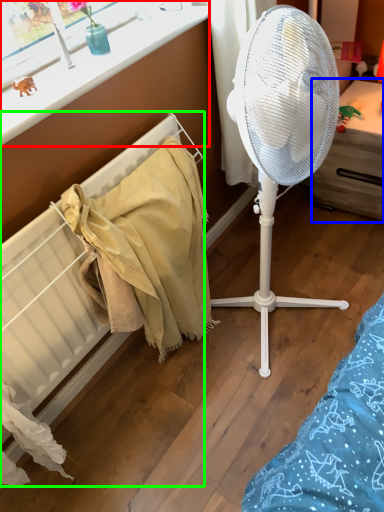
Question: Considering the real-world distances, which object is closest to window frame (highlighted by a red box)? furniture (highlighted by a blue box) or radiator (highlighted by a green box).

Choices:
 (A) furniture
 (B) radiator

Answer: (B)